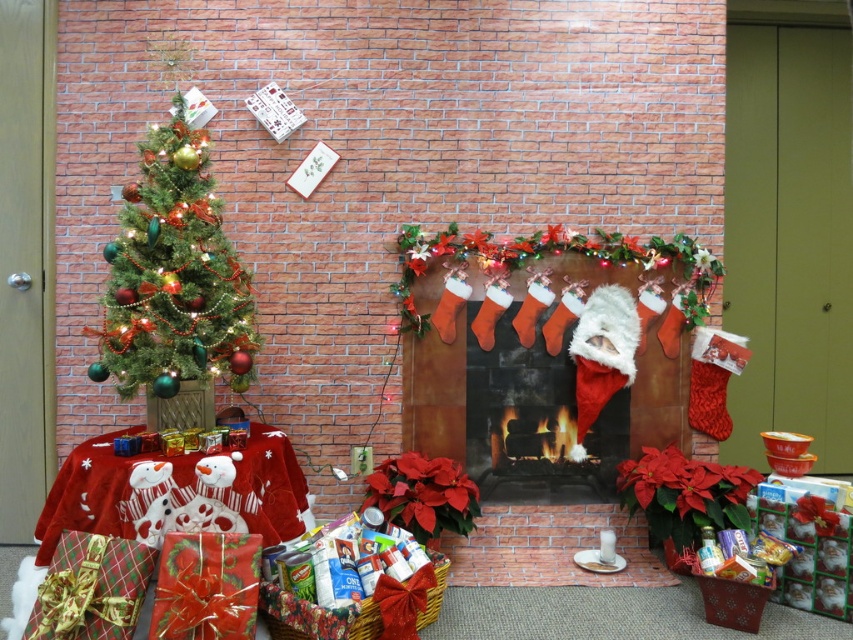
Question: Does knitted wool fireplace at center have a larger size compared to green matte christmas tree at left?

Choices:
 (A) no
 (B) yes

Answer: (B)

Question: Does knitted wool fireplace at center have a smaller size compared to green matte christmas tree at left?

Choices:
 (A) no
 (B) yes

Answer: (A)

Question: Is knitted wool fireplace at center smaller than green matte christmas tree at left?

Choices:
 (A) no
 (B) yes

Answer: (A)

Question: Among these points, which one is nearest to the camera?

Choices:
 (A) (172, 132)
 (B) (532, 465)

Answer: (A)